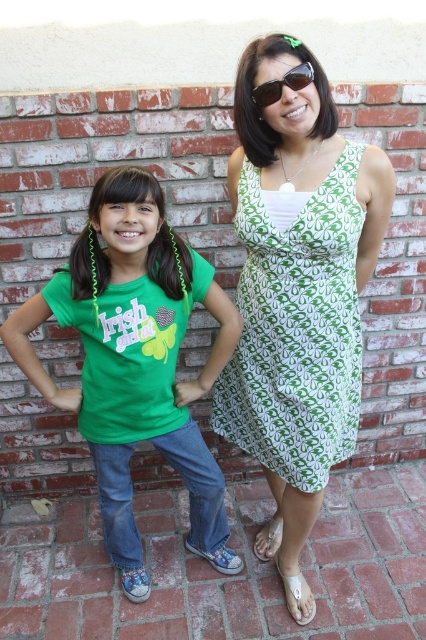
You are a photographer who wants to adjust the lighting so that the sunglasses at upper center and the green printed dress at center are both well lit. Which object should you focus the light on first?

The sunglasses at upper center should be focused on first since the green printed dress at center is located below it, so adjusting the light for the sunglasses will naturally illuminate the dress as well.

You are standing at the point marked by the coordinates point (152, 420) and want to take a photo of the two people in the scene. Considering your current position, can you estimate how far you are from them?

The distance between you and the two people at point (152, 420) is 5.37 feet.